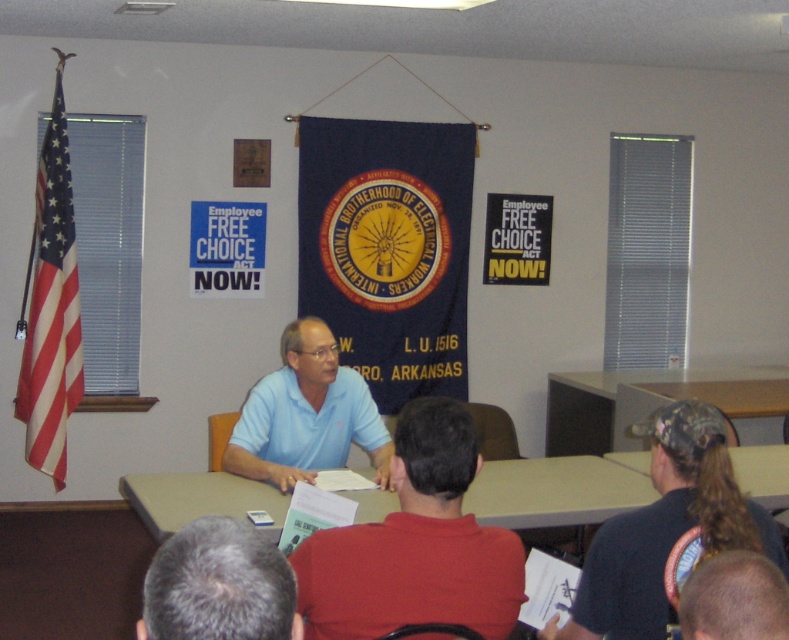
You are an event photographer who needs to capture a clear photo of both the light blue polo shirt at center and the smooth bald head at lower right. Based on their sizes, which one should you focus on first to ensure both are in frame?

The light blue polo shirt at center is larger in size than the smooth bald head at lower right, so you should focus on the light blue polo shirt at center first to ensure both are in frame.

You are a photographer in this room and want to take a photo of the gray hair at lower left and the smooth bald head at lower right. Which one is positioned higher in the frame?

The gray hair at lower left is located above the smooth bald head at lower right, so it is positioned higher in the frame.

You are a photographer standing in the meeting room. You want to take a photo that includes both the light blue polo shirt at center and the smooth bald head at lower right. Given that your camera has a maximum focus range of 20 inches, will you be able to capture both subjects in focus without moving closer?

The distance between the light blue polo shirt at center and the smooth bald head at lower right is 23.57 inches. Since the camera can only focus within 20 inches, you will need to move closer to ensure both are in focus.